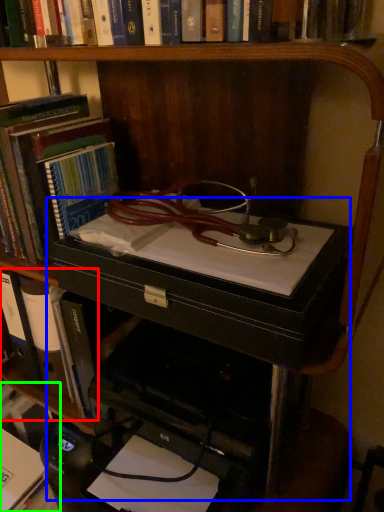
Question: Considering the real-world distances, which object is closest to book (highlighted by a red box)? computer desk (highlighted by a blue box) or book (highlighted by a green box).

Choices:
 (A) computer desk
 (B) book

Answer: (B)